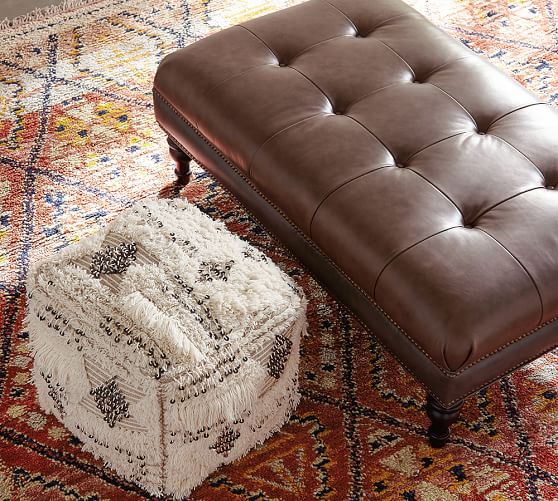
You are a GUI agent. You are given a task and a screenshot of the screen. Output one action in this format:
    pyautogui.click(x=<x>, y=<y>)
    Task: Click on the cushion
    Image resolution: width=558 pixels, height=501 pixels.
    Given the screenshot: What is the action you would take?
    pyautogui.click(x=420, y=139)